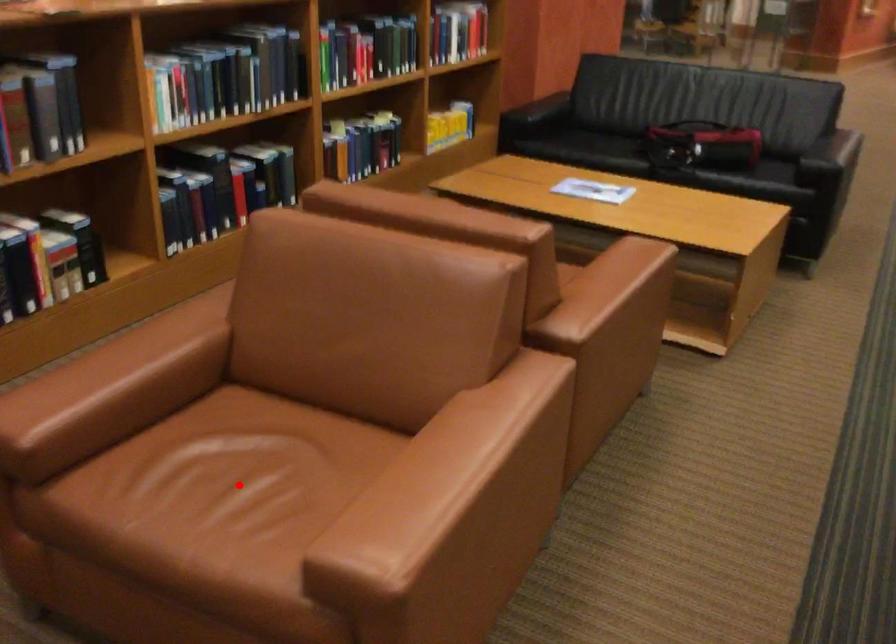
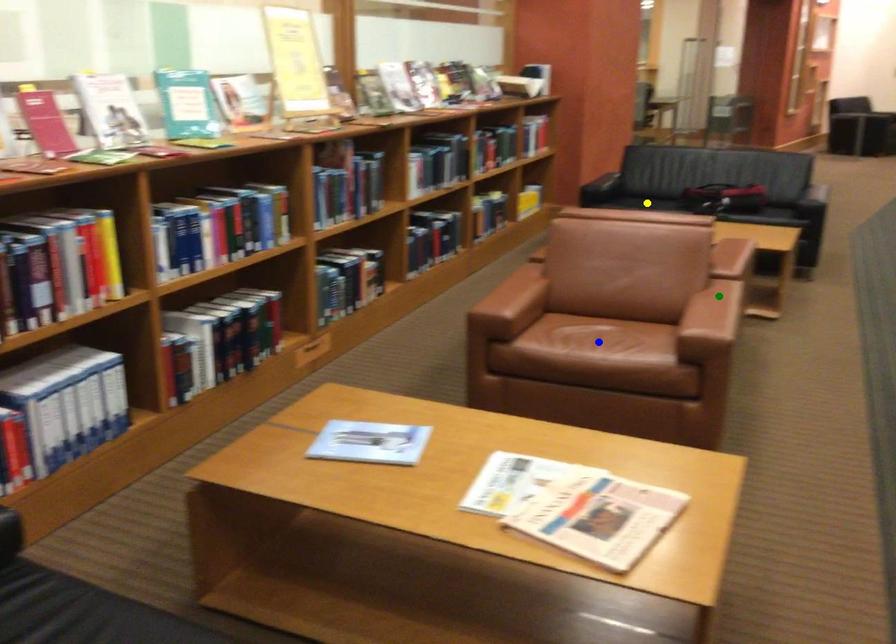
Question: I am providing you with two images of the same scene from different viewpoints. A red point is marked on the first image. You are given multiple points on the second image. Which spot in image 2 lines up with the point in image 1?

Choices:
 (A) blue point
 (B) green point
 (C) yellow point

Answer: (A)